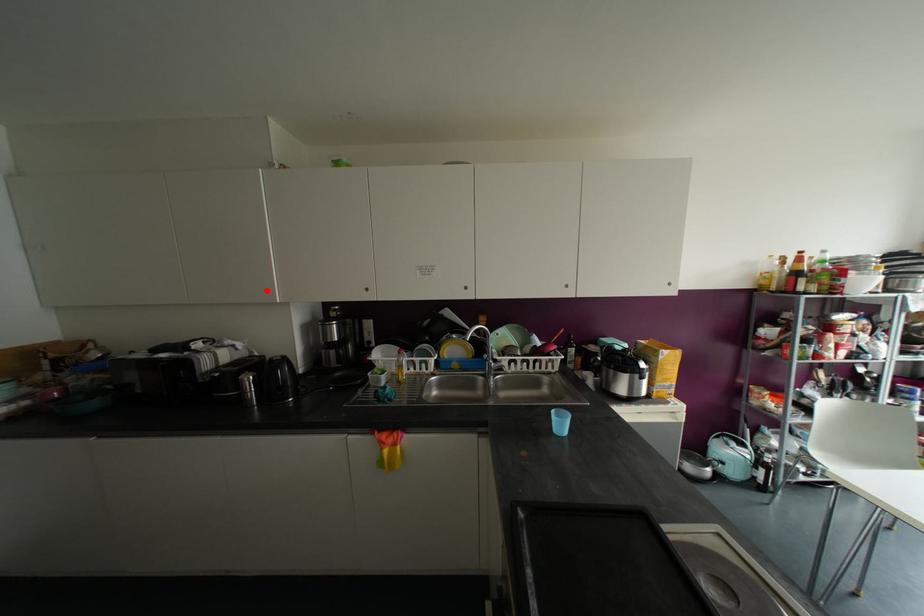
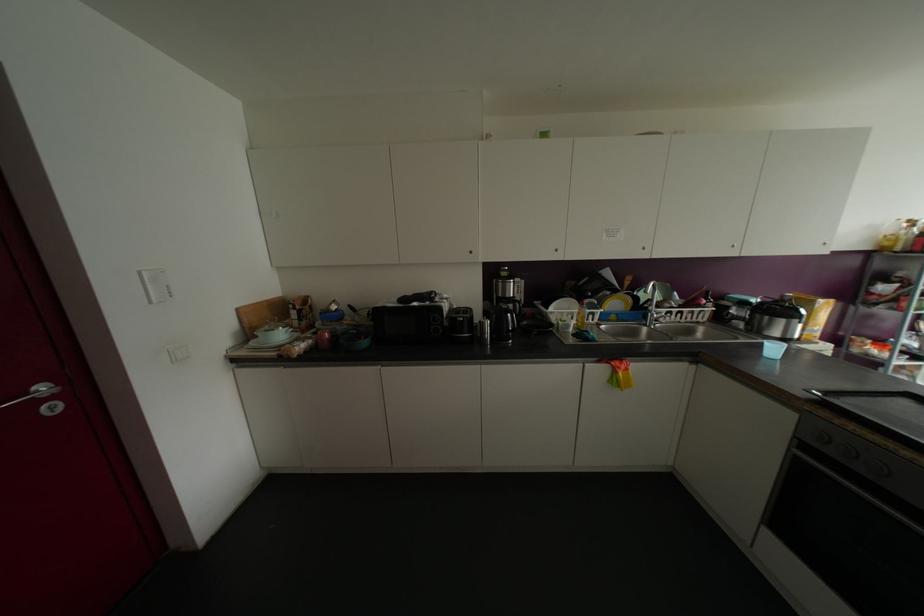
Find the pixel in the second image that matches the highlighted location in the first image.

(469, 252)